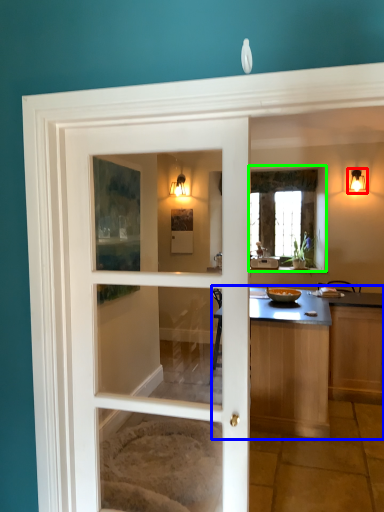
Question: Estimate the real-world distances between objects in this image. Which object is closer to light fixture (highlighted by a red box), countertop (highlighted by a blue box) or window (highlighted by a green box)?

Choices:
 (A) countertop
 (B) window

Answer: (B)